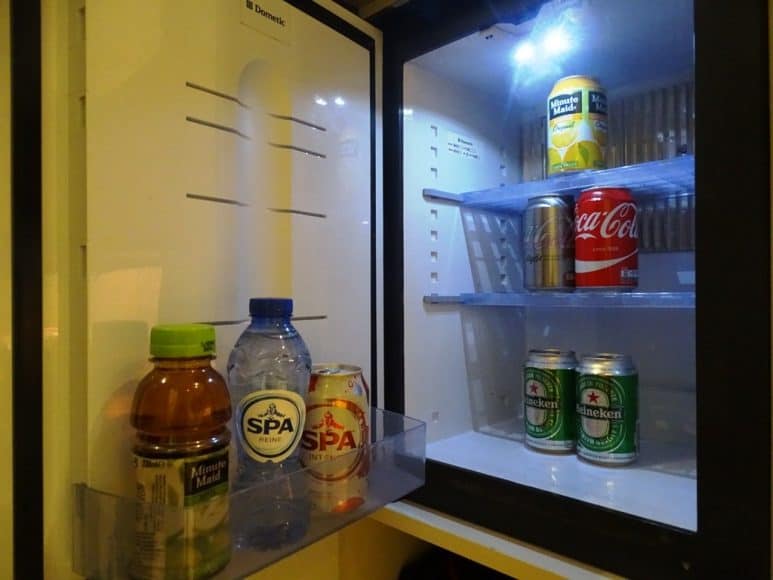
Locate an element on the screen. The height and width of the screenshot is (580, 773). light is located at coordinates (535, 50).